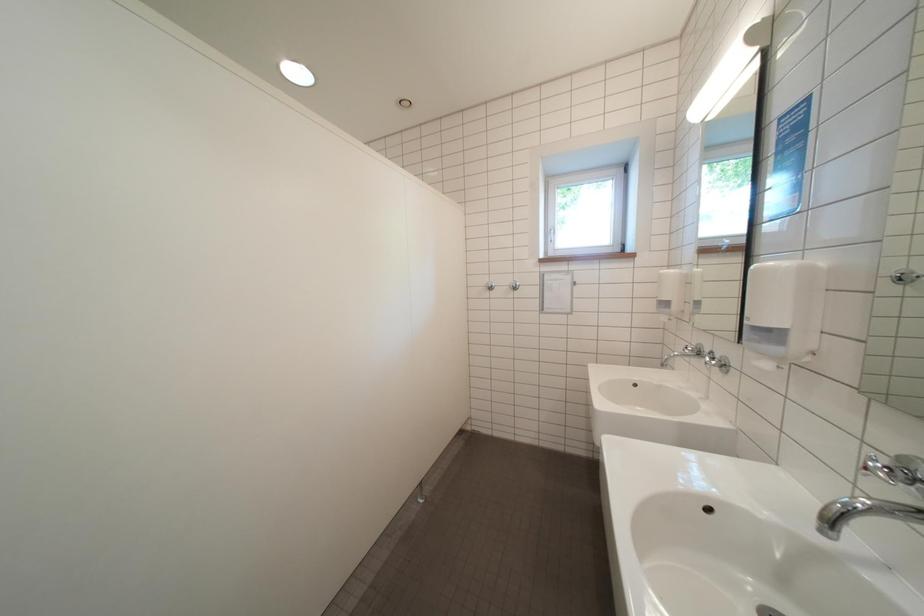
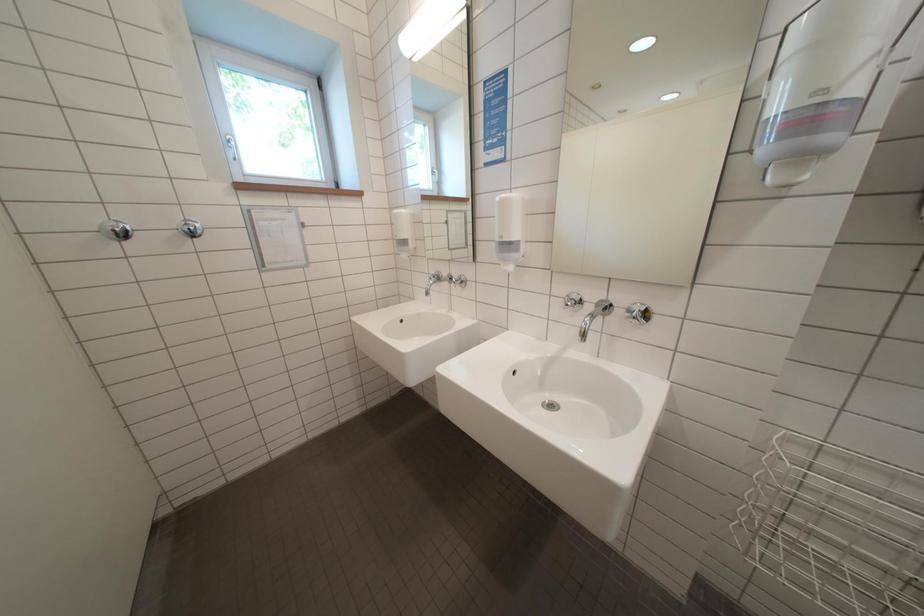
Question: The images are taken continuously from a first-person perspective. In which direction is your viewpoint rotating?

Choices:
 (A) Left
 (B) Right
 (C) Up
 (D) Down

Answer: (B)